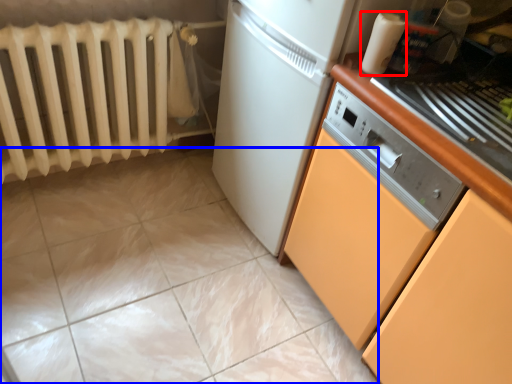
Question: Among these objects, which one is nearest to the camera, kitchen appliance (highlighted by a red box) or ceramic tile (highlighted by a blue box)?

Choices:
 (A) kitchen appliance
 (B) ceramic tile

Answer: (B)